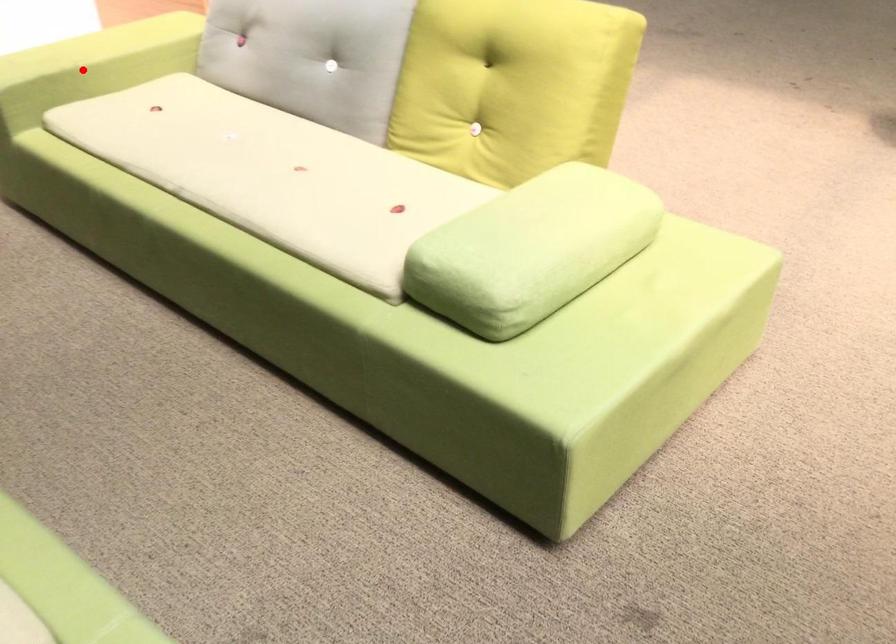
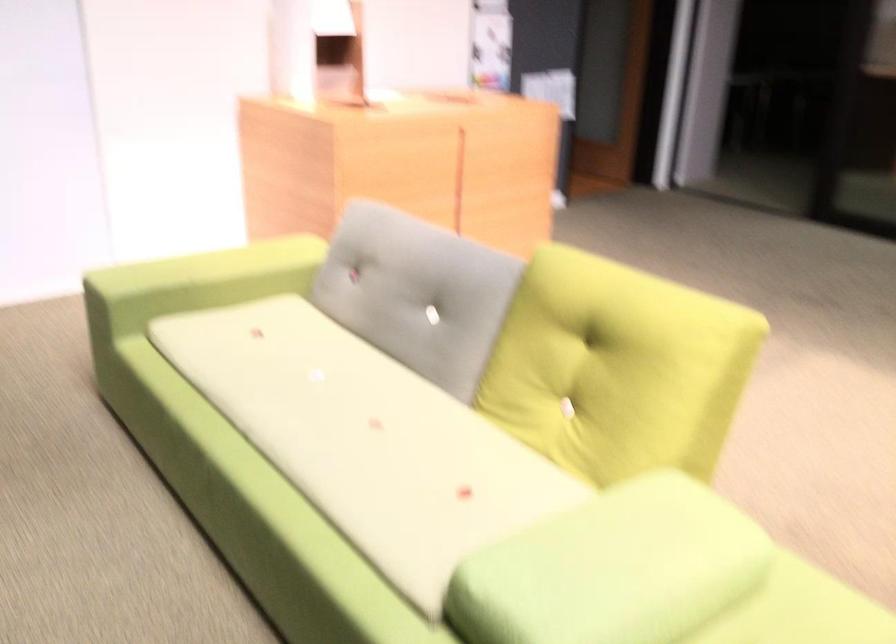
Where in the second image is the point corresponding to the highlighted location from the first image?

(194, 283)